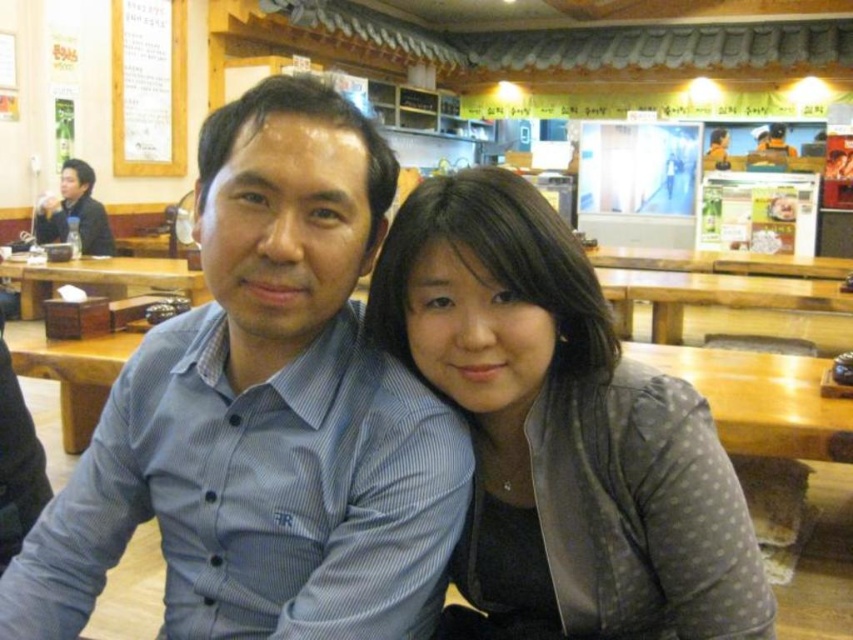
From the picture: You are a server in a Korean restaurant and need to place a 1.5 foot tall vase on the wooden table at center. Can the vase fit on the table without touching the matte black jacket at upper left?

The wooden table at center has a lesser height compared to matte black jacket at upper left, meaning the table is shorter than the jacket. Since the vase is 1.5 feet tall, placing it on the table would make it rise to the same height as the jacket. However, the jacket is already positioned at upper left, so there might not be enough vertical space between the table and the jacket for the vase to fit without touching. Therefore, the vase may not fit safely on the wooden table at center without touching the 1

You are a fashion designer who needs to determine which jacket to recommend for a client who prefers a more compact and space saving option. Based on the image, which jacket between the gray dotted jacket at center and the matte black jacket at upper left would you suggest?

The gray dotted jacket at center has a smaller size compared to matte black jacket at upper left, so it is more compact and space saving. Therefore, the gray dotted jacket at center would be the better recommendation.

You are a photographer trying to capture a candid shot of the gray dotted jacket at center and the wooden table at center. Since you want to focus on the jacket, which object should you zoom in on more and why?

The gray dotted jacket at center has a smaller size compared to the wooden table at center, so you should zoom in more on the gray dotted jacket at center to ensure it appears larger in the photo and remains the main focus.